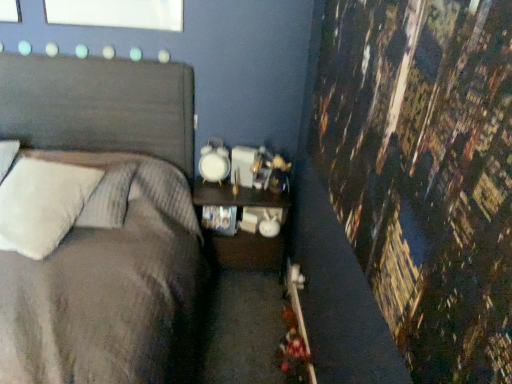
Measure the distance between white fluffy pillow at left and camera.

white fluffy pillow at left is 1.72 meters away from camera.

The image size is (512, 384). What do you see at coordinates (42, 204) in the screenshot?
I see `white fluffy pillow at left` at bounding box center [42, 204].

What do you see at coordinates (106, 229) in the screenshot? I see `textured gray bed at left` at bounding box center [106, 229].

This screenshot has height=384, width=512. What do you see at coordinates (249, 252) in the screenshot?
I see `wooden nightstand at center` at bounding box center [249, 252].

At what (x,y) coordinates should I click in order to perform the action: click on white fluffy pillow at left. Please return your answer as a coordinate pair (x, y). This screenshot has height=384, width=512. Looking at the image, I should click on (42, 204).

How different are the orientations of textured gray bed at left and white fluffy pillow at left in degrees?

24.6 degrees separate the facing orientations of textured gray bed at left and white fluffy pillow at left.

From the image's perspective, between textured gray bed at left and white fluffy pillow at left, who is located below?

textured gray bed at left is shown below in the image.

Is white fluffy pillow at left located within textured gray bed at left?

Yes, white fluffy pillow at left is a part of textured gray bed at left.

Is point (42, 330) closer or farther from the camera than point (17, 219)?

Point (42, 330) is positioned closer to the camera compared to point (17, 219).

Who is shorter, wooden nightstand at center or textured gray bed at left?

wooden nightstand at center.

Are wooden nightstand at center and textured gray bed at left beside each other?

wooden nightstand at center and textured gray bed at left are clearly separated.

Would you say wooden nightstand at center contains textured gray bed at left?

No.

From a real-world perspective, is wooden nightstand at center under white fluffy pillow at left?

Yes, from a real-world perspective, wooden nightstand at center is beneath white fluffy pillow at left.

Consider the image. Between wooden nightstand at center and white fluffy pillow at left, which one has less height?

white fluffy pillow at left.

Based on the photo, is wooden nightstand at center smaller than white fluffy pillow at left?

Incorrect, wooden nightstand at center is not smaller in size than white fluffy pillow at left.

Is wooden nightstand at center located outside white fluffy pillow at left?

wooden nightstand at center lies outside white fluffy pillow at left's area.

Considering the sizes of objects white fluffy pillow at left and wooden nightstand at center in the image provided, who is wider, white fluffy pillow at left or wooden nightstand at center?

white fluffy pillow at left.

Is white fluffy pillow at left positioned with its back to wooden nightstand at center?

white fluffy pillow at left is not turned away from wooden nightstand at center.

Considering the positions of points (79, 189) and (269, 202), is point (79, 189) farther from camera compared to point (269, 202)?

That is False.

Can you confirm if white fluffy pillow at left is shorter than wooden nightstand at center?

Yes.

Looking at this image, considering the sizes of textured gray bed at left and wooden nightstand at center in the image, is textured gray bed at left taller or shorter than wooden nightstand at center?

In the image, textured gray bed at left appears to be taller than wooden nightstand at center.

What are the coordinates of `nightstand lying behind the textured gray bed at left` in the screenshot? It's located at (249, 252).

How many degrees apart are the facing directions of textured gray bed at left and wooden nightstand at center?

They differ by 0.221 degrees in their facing directions.

Is white fluffy pillow at left looking in the opposite direction of textured gray bed at left?

Yes, white fluffy pillow at left is positioned with its back facing textured gray bed at left.

Is white fluffy pillow at left positioned behind textured gray bed at left?

That is True.

Would you say white fluffy pillow at left is a long distance from textured gray bed at left?

They are positioned close to each other.

Is point (40, 222) closer or farther from the camera than point (177, 285)?

Point (40, 222) is positioned closer to the camera compared to point (177, 285).

Identify the location of bed in front of the white fluffy pillow at left. (106, 229).

What are the coordinates of `nightstand above the textured gray bed at left (from the image's perspective)` in the screenshot? It's located at (249, 252).

Considering their positions, is white fluffy pillow at left positioned further to wooden nightstand at center than textured gray bed at left?

white fluffy pillow at left is further to wooden nightstand at center.

Which object lies nearer to the anchor point white fluffy pillow at left, wooden nightstand at center or textured gray bed at left?

Based on the image, textured gray bed at left appears to be nearer to white fluffy pillow at left.

Looking at the image, which one is located closer to textured gray bed at left, white fluffy pillow at left or wooden nightstand at center?

white fluffy pillow at left is positioned closer to the anchor textured gray bed at left.

Looking at the image, which one is located further to textured gray bed at left, wooden nightstand at center or white fluffy pillow at left?

wooden nightstand at center is positioned further to the anchor textured gray bed at left.

Based on their spatial positions, is textured gray bed at left or wooden nightstand at center closer to white fluffy pillow at left?

textured gray bed at left.

From the image, which object appears to be nearer to wooden nightstand at center, textured gray bed at left or white fluffy pillow at left?

textured gray bed at left.

You are a GUI agent. You are given a task and a screenshot of the screen. Output one action in this format:
    pyautogui.click(x=<x>, y=<y>)
    Task: Click on the pillow between textured gray bed at left and wooden nightstand at center in the front-back direction
    The image size is (512, 384).
    Given the screenshot: What is the action you would take?
    pyautogui.click(x=42, y=204)